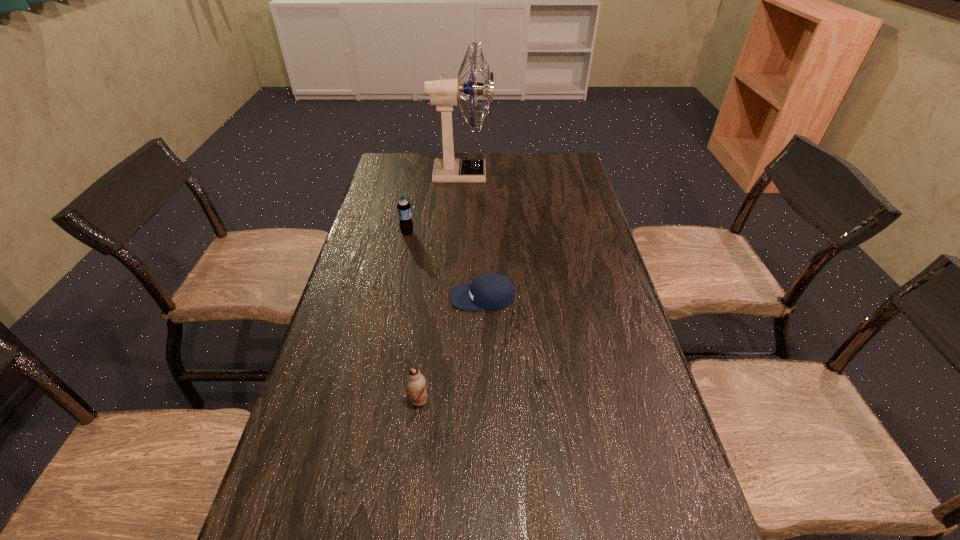
Locate an element on the screen. empty space that is in between the third tallest object and the shortest object is located at coordinates (450, 349).

In order to click on free space between the fan and the baseball cap in this screenshot , I will do `click(472, 235)`.

Locate an element on the screen. The width and height of the screenshot is (960, 540). free spot between the baseball cap and the second shortest object is located at coordinates tap(450, 349).

This screenshot has width=960, height=540. Find the location of `free area in between the baseball cap and the tallest object`. free area in between the baseball cap and the tallest object is located at coordinates (472, 235).

You are a GUI agent. You are given a task and a screenshot of the screen. Output one action in this format:
    pyautogui.click(x=<x>, y=<y>)
    Task: Click on the free space between the leftmost object and the nearest object
    
    Given the screenshot: What is the action you would take?
    pyautogui.click(x=413, y=317)

Find the location of a particular element. Image resolution: width=960 pixels, height=540 pixels. vacant space that's between the nearest object and the farthest object is located at coordinates (441, 287).

Image resolution: width=960 pixels, height=540 pixels. I want to click on free area in between the chocolate milk and the leftmost object, so click(x=413, y=317).

Where is `free space between the farthest object and the shortest object`? The height and width of the screenshot is (540, 960). free space between the farthest object and the shortest object is located at coordinates (472, 235).

Locate an element on the screen. This screenshot has width=960, height=540. vacant area between the nearest object and the baseball cap is located at coordinates (450, 349).

The width and height of the screenshot is (960, 540). Identify the location of vacant area that lies between the baseball cap and the chocolate milk. coord(450,349).